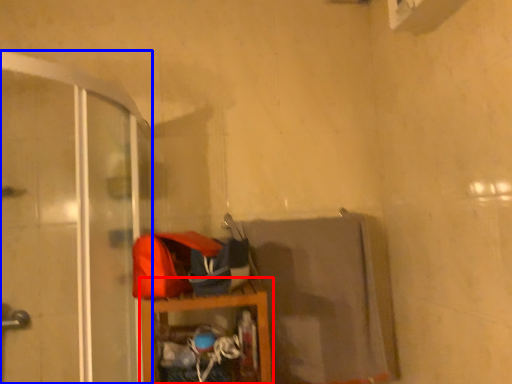
Question: Which object appears farthest to the camera in this image, furniture (highlighted by a red box) or screen door (highlighted by a blue box)?

Choices:
 (A) furniture
 (B) screen door

Answer: (A)